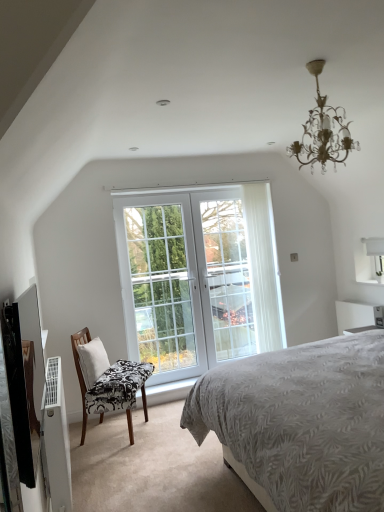
Question: Does white sheer curtain at center have a smaller size compared to white plastic air conditioner at lower left?

Choices:
 (A) no
 (B) yes

Answer: (B)

Question: Is white sheer curtain at center further to the viewer compared to white plastic air conditioner at lower left?

Choices:
 (A) yes
 (B) no

Answer: (A)

Question: Does white sheer curtain at center come in front of white plastic air conditioner at lower left?

Choices:
 (A) no
 (B) yes

Answer: (A)

Question: Is white sheer curtain at center oriented away from white plastic air conditioner at lower left?

Choices:
 (A) no
 (B) yes

Answer: (A)

Question: From a real-world perspective, is white sheer curtain at center beneath white plastic air conditioner at lower left?

Choices:
 (A) no
 (B) yes

Answer: (A)

Question: Is there a large distance between white sheer curtain at center and white plastic air conditioner at lower left?

Choices:
 (A) no
 (B) yes

Answer: (B)

Question: Considering the relative sizes of white glass screen door at center and white fabric pillow at left in the image provided, is white glass screen door at center smaller than white fabric pillow at left?

Choices:
 (A) no
 (B) yes

Answer: (A)

Question: Does white glass screen door at center have a greater height compared to white fabric pillow at left?

Choices:
 (A) no
 (B) yes

Answer: (B)

Question: Can you confirm if white glass screen door at center is bigger than white fabric pillow at left?

Choices:
 (A) no
 (B) yes

Answer: (B)

Question: Does white glass screen door at center have a lesser height compared to white fabric pillow at left?

Choices:
 (A) no
 (B) yes

Answer: (A)

Question: Does white glass screen door at center appear on the right side of white fabric pillow at left?

Choices:
 (A) yes
 (B) no

Answer: (A)

Question: From a real-world perspective, is white glass screen door at center over white fabric pillow at left?

Choices:
 (A) no
 (B) yes

Answer: (B)

Question: Is white glass door at center, which appears as the 2th window when viewed from the left, located within white glass door at center, placed as the first window when sorted from left to right?

Choices:
 (A) yes
 (B) no

Answer: (B)